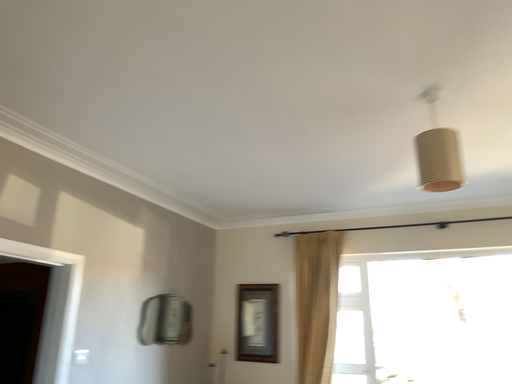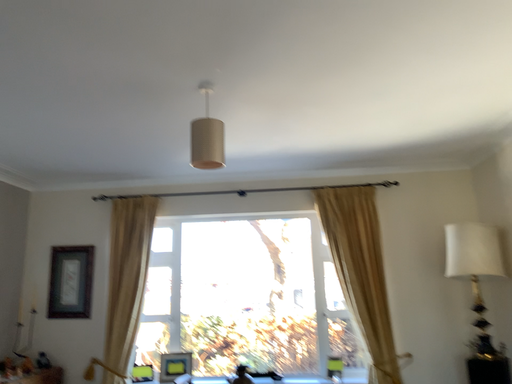
Question: How did the camera likely rotate when shooting the video?

Choices:
 (A) rotated downward
 (B) rotated upward

Answer: (A)